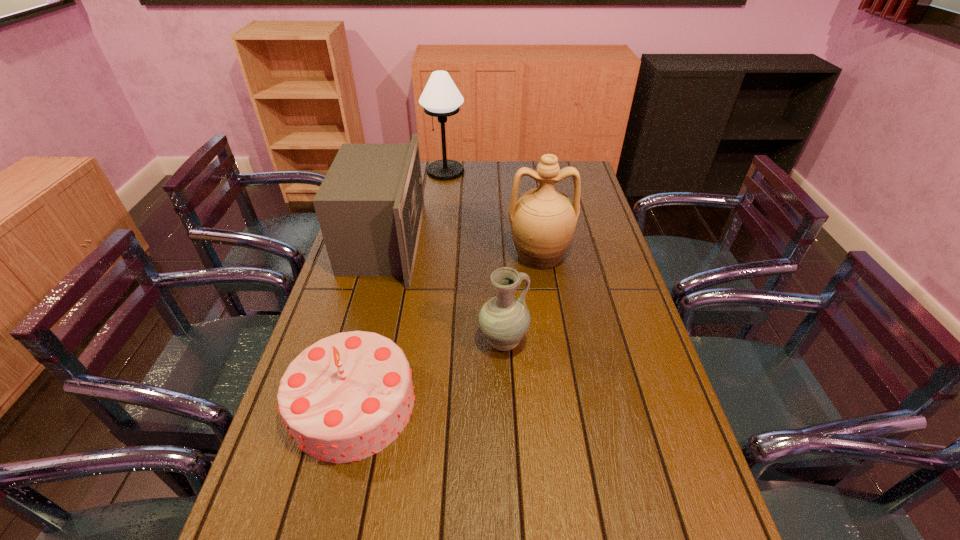
In order to click on the farthest object in this screenshot , I will do `click(441, 98)`.

This screenshot has height=540, width=960. What are the coordinates of `the farther pitcher` in the screenshot? It's located at (543, 220).

Where is `microwave oven`? The image size is (960, 540). microwave oven is located at coordinates (370, 205).

Locate an element on the screen. The height and width of the screenshot is (540, 960). the shorter pitcher is located at coordinates (504, 319).

Image resolution: width=960 pixels, height=540 pixels. What are the coordinates of `birthday cake` in the screenshot? It's located at (346, 397).

This screenshot has height=540, width=960. I want to click on vacant point located on the front of the table lamp, so click(441, 212).

The width and height of the screenshot is (960, 540). In order to click on vacant space located on the right of the farther pitcher in this screenshot , I will do `click(592, 255)`.

Where is `vacant space situated on the front-facing side of the microwave oven`? vacant space situated on the front-facing side of the microwave oven is located at coordinates (494, 242).

Where is `free space located 0.180m on the handle side of the nearer pitcher`? This screenshot has height=540, width=960. free space located 0.180m on the handle side of the nearer pitcher is located at coordinates (594, 342).

Identify the location of vacant space positioned on the back of the birthday cake. The image size is (960, 540). (376, 306).